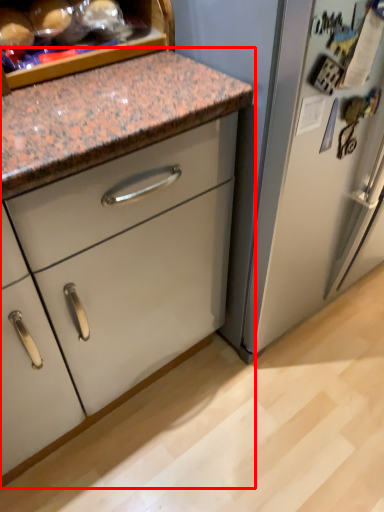
Question: From the image's perspective, what is the correct spatial positioning of cabinetry (annotated by the red box) in reference to food?

Choices:
 (A) below
 (B) above

Answer: (A)